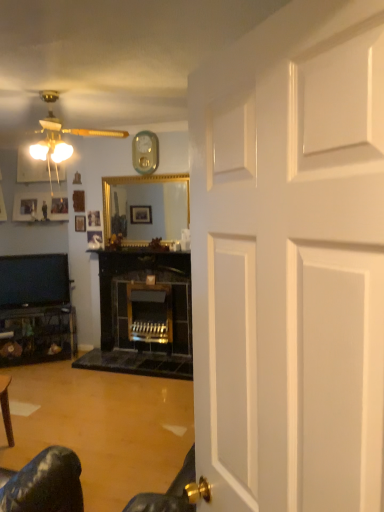
Image resolution: width=384 pixels, height=512 pixels. Describe the element at coordinates (78, 201) in the screenshot. I see `wooden picture frame at upper left, arranged as the third picture frame when viewed from the right` at that location.

At what (x,y) coordinates should I click in order to perform the action: click on wooden picture frame at upper left, acting as the 2th picture frame starting from the back. Please return your answer as a coordinate pair (x, y). This screenshot has width=384, height=512. Looking at the image, I should click on (80, 223).

Identify the location of matte white ceiling fan at upper left. click(x=51, y=150).

Locate an element on the screen. This screenshot has width=384, height=512. matte black picture frame at upper left, which ranks as the first picture frame in back-to-front order is located at coordinates (40, 207).

How much space does matte black picture frame at upper left, which ranks as the first picture frame in back-to-front order, occupy horizontally?

It is 4.55 inches.

This screenshot has width=384, height=512. Describe the element at coordinates (146, 208) in the screenshot. I see `gold-framed mirror at center` at that location.

What do you see at coordinates (145, 152) in the screenshot?
I see `metallic silver clock at upper center` at bounding box center [145, 152].

Locate an element on the screen. The image size is (384, 512). wooden picture frame at center, which is counted as the 1th picture frame, starting from the right is located at coordinates (94, 239).

From a real-world perspective, which object rests below the other?

wooden picture frame at upper left, acting as the 2th picture frame starting from the back, from a real-world perspective.

Can you confirm if wooden picture frame at upper left, the 2th picture frame from the right, is taller than matte white ceiling fan at upper left?

Yes.

Between wooden picture frame at upper left, the 2th picture frame from the right, and matte white ceiling fan at upper left, which one appears on the left side from the viewer's perspective?

From the viewer's perspective, wooden picture frame at upper left, the 2th picture frame from the right, appears more on the left side.

Is wooden picture frame at upper left, acting as the 2th picture frame starting from the back, turned away from matte white ceiling fan at upper left?

wooden picture frame at upper left, acting as the 2th picture frame starting from the back, does not have its back to matte white ceiling fan at upper left.

From the image's perspective, which object appears higher, wooden picture frame at upper left, acting as the 2th picture frame starting from the back, or wooden picture frame at center, arranged as the fourth picture frame when viewed from the back?

wooden picture frame at upper left, acting as the 2th picture frame starting from the back, appears higher in the image.

Measure the distance from wooden picture frame at upper left, the 2th picture frame from the right, to wooden picture frame at center, arranged as the fourth picture frame when viewed from the back.

They are 7.62 inches apart.

Is wooden picture frame at upper left, arranged as the 3th picture frame when viewed from the left, positioned far away from wooden picture frame at center, the fourth picture frame positioned from the left?

They are positioned close to each other.

In the scene shown: Is matte white ceiling fan at upper left shorter than gold-framed mirror at center?

Indeed, matte white ceiling fan at upper left has a lesser height compared to gold-framed mirror at center.

Which point is more forward, (68, 146) or (171, 210)?

The point (171, 210) is closer.

Based on their sizes in the image, would you say matte white ceiling fan at upper left is bigger or smaller than gold-framed mirror at center?

Considering their sizes, matte white ceiling fan at upper left takes up less space than gold-framed mirror at center.

Is matte white ceiling fan at upper left turned away from gold-framed mirror at center?

That's right, matte white ceiling fan at upper left is facing away from gold-framed mirror at center.

Identify the location of picture frame that is the 1st object to the left of the wooden picture frame at center, the first picture frame when ordered from front to back, starting at the anchor. This screenshot has height=512, width=384. (80, 223).

Considering the sizes of objects wooden picture frame at center, the fourth picture frame positioned from the left, and wooden picture frame at upper left, the 2th picture frame from the right, in the image provided, who is bigger, wooden picture frame at center, the fourth picture frame positioned from the left, or wooden picture frame at upper left, the 2th picture frame from the right,?

wooden picture frame at center, the fourth picture frame positioned from the left.

Based on the photo, between wooden picture frame at center, the fourth picture frame positioned from the left, and wooden picture frame at upper left, the 3th picture frame viewed from the front, which one has larger width?

wooden picture frame at center, the fourth picture frame positioned from the left, is wider.

What's the angular difference between wooden picture frame at center, the first picture frame when ordered from front to back, and wooden picture frame at upper left, arranged as the 3th picture frame when viewed from the left,'s facing directions?

The angle between the facing direction of wooden picture frame at center, the first picture frame when ordered from front to back, and the facing direction of wooden picture frame at upper left, arranged as the 3th picture frame when viewed from the left, is 20.2 degrees.

From a real-world perspective, is metallic silver clock at upper center above or below wooden picture frame at upper left, the 3th picture frame viewed from the front?

metallic silver clock at upper center is above wooden picture frame at upper left, the 3th picture frame viewed from the front.

Between metallic silver clock at upper center and wooden picture frame at upper left, the 3th picture frame viewed from the front, which one has larger size?

With larger size is metallic silver clock at upper center.

Is metallic silver clock at upper center at the right side of wooden picture frame at upper left, arranged as the 3th picture frame when viewed from the left?

Yes, metallic silver clock at upper center is to the right of wooden picture frame at upper left, arranged as the 3th picture frame when viewed from the left.

Is metallic silver clock at upper center looking in the opposite direction of wooden picture frame at upper left, arranged as the 3th picture frame when viewed from the left?

No, metallic silver clock at upper center's orientation is not away from wooden picture frame at upper left, arranged as the 3th picture frame when viewed from the left.

Is metallic silver clock at upper center positioned far away from matte black picture frame at upper left, which ranks as the first picture frame in back-to-front order?

That's right, there is a large distance between metallic silver clock at upper center and matte black picture frame at upper left, which ranks as the first picture frame in back-to-front order.

Would you say metallic silver clock at upper center is to the left or to the right of matte black picture frame at upper left, which is the fourth picture frame in right-to-left order, in the picture?

metallic silver clock at upper center is positioned on matte black picture frame at upper left, which is the fourth picture frame in right-to-left order,'s right side.

Is metallic silver clock at upper center further to the viewer compared to matte black picture frame at upper left, which is the 4th picture frame in front-to-back order?

That is False.

Consider the image. Is metallic silver clock at upper center positioned with its back to matte black picture frame at upper left, which is the fourth picture frame in right-to-left order?

That's not correct — metallic silver clock at upper center is not looking away from matte black picture frame at upper left, which is the fourth picture frame in right-to-left order.

Is matte white ceiling fan at upper left turned away from wooden picture frame at center, which is counted as the 1th picture frame, starting from the right?

No, matte white ceiling fan at upper left is not facing away from wooden picture frame at center, which is counted as the 1th picture frame, starting from the right.

Considering the positions of objects matte white ceiling fan at upper left and wooden picture frame at center, the first picture frame when ordered from front to back, in the image provided, who is more to the right, matte white ceiling fan at upper left or wooden picture frame at center, the first picture frame when ordered from front to back,?

matte white ceiling fan at upper left.

Considering the positions of objects matte white ceiling fan at upper left and wooden picture frame at center, which is counted as the 1th picture frame, starting from the right, in the image provided, who is behind, matte white ceiling fan at upper left or wooden picture frame at center, which is counted as the 1th picture frame, starting from the right,?

wooden picture frame at center, which is counted as the 1th picture frame, starting from the right, is more distant.

Would you say matte white ceiling fan at upper left is inside or outside wooden picture frame at center, the fourth picture frame positioned from the left?

matte white ceiling fan at upper left is not inside wooden picture frame at center, the fourth picture frame positioned from the left, it's outside.

At what (x,y) coordinates should I click in order to perform the action: click on the 3rd picture frame behind the matte white ceiling fan at upper left, starting your count from the anchor. Please return your answer as a coordinate pair (x, y). The width and height of the screenshot is (384, 512). Looking at the image, I should click on (80, 223).

Starting from the wooden picture frame at center, arranged as the fourth picture frame when viewed from the back, which picture frame is the 1st one to the left? Please provide its 2D coordinates.

[(80, 223)]

Estimate the real-world distances between objects in this image. Which object is further from wooden picture frame at center, which is counted as the 1th picture frame, starting from the right, wooden picture frame at upper left, arranged as the third picture frame when viewed from the right, or gold-framed mirror at center?

Based on the image, gold-framed mirror at center appears to be further to wooden picture frame at center, which is counted as the 1th picture frame, starting from the right.

Based on their spatial positions, is gold-framed mirror at center or metallic silver clock at upper center closer to matte white ceiling fan at upper left?

metallic silver clock at upper center is positioned closer to the anchor matte white ceiling fan at upper left.

Consider the image. Which object lies further to the anchor point matte black picture frame at upper left, which is the 4th picture frame in front-to-back order, metallic silver clock at upper center or gold-framed mirror at center?

metallic silver clock at upper center is further to matte black picture frame at upper left, which is the 4th picture frame in front-to-back order.

Based on their spatial positions, is wooden picture frame at upper left, positioned as the second picture frame in left-to-right order, or matte black tv at left further from wooden picture frame at upper left, arranged as the 3th picture frame when viewed from the left?

Based on the image, matte black tv at left appears to be further to wooden picture frame at upper left, arranged as the 3th picture frame when viewed from the left.

Considering their positions, is metallic silver clock at upper center positioned further to matte white ceiling fan at upper left than wooden picture frame at upper left, the third picture frame when ordered from back to front?

metallic silver clock at upper center lies further to matte white ceiling fan at upper left than the other object.

Which object lies further to the anchor point matte black tv at left, metallic silver clock at upper center or gold-framed mirror at center?

The object further to matte black tv at left is metallic silver clock at upper center.

Based on their spatial positions, is metallic silver clock at upper center or matte black picture frame at upper left, which ranks as the first picture frame in back-to-front order, further from matte black tv at left?

metallic silver clock at upper center lies further to matte black tv at left than the other object.

When comparing their distances from matte black picture frame at upper left, which ranks as the first picture frame in back-to-front order, does metallic silver clock at upper center or wooden picture frame at center, the fourth picture frame positioned from the left, seem further?

Based on the image, metallic silver clock at upper center appears to be further to matte black picture frame at upper left, which ranks as the first picture frame in back-to-front order.

Where is `picture frame between matte white ceiling fan at upper left and wooden picture frame at upper left, positioned as the second picture frame in left-to-right order, from front to back`? picture frame between matte white ceiling fan at upper left and wooden picture frame at upper left, positioned as the second picture frame in left-to-right order, from front to back is located at coordinates (94, 239).

Locate an element on the screen. mirror positioned between matte white ceiling fan at upper left and matte black picture frame at upper left, which ranks as the first picture frame in back-to-front order, from near to far is located at coordinates (146, 208).

This screenshot has width=384, height=512. What are the coordinates of `television between matte white ceiling fan at upper left and wooden picture frame at upper left, positioned as the second picture frame in left-to-right order, from front to back` in the screenshot? It's located at (34, 280).

I want to click on television situated between matte black picture frame at upper left, which is the fourth picture frame in right-to-left order, and metallic silver clock at upper center from left to right, so click(x=34, y=280).